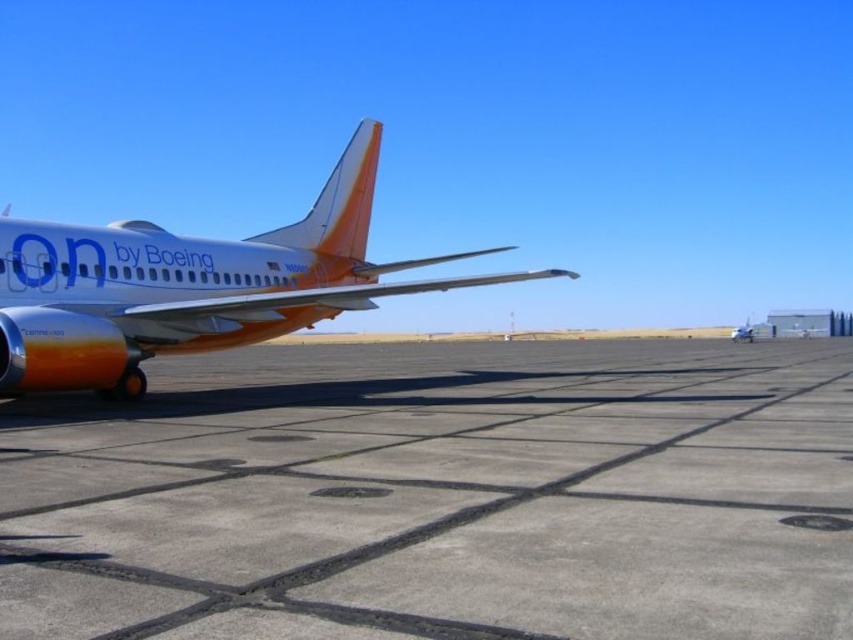
You are a maintenance worker on the airport tarmac and need to place a heavy equipment container on an area that can support its weight. According to the scene, which object between the concrete at center and the orange matte airplane at left should you choose?

You should choose the orange matte airplane at left because the concrete at center has a smaller size compared to the orange matte airplane at left, meaning the airplane might have a larger surface area to support heavy equipment.

You are a maintenance worker on the airport tarmac. You need to move a piece of equipment that is 2 meters wide from the concrete at center to the orange matte airplane at left. Can the equipment fit through the space between the two objects?

The concrete at center is wider than the orange matte airplane at left. Since the equipment is 2 meters wide, it depends on the actual width of the space between them. However, the description only states that the concrete at center surpasses the airplane in width, but does not provide specific measurements. Therefore, it is unclear if the equipment will fit without further information.